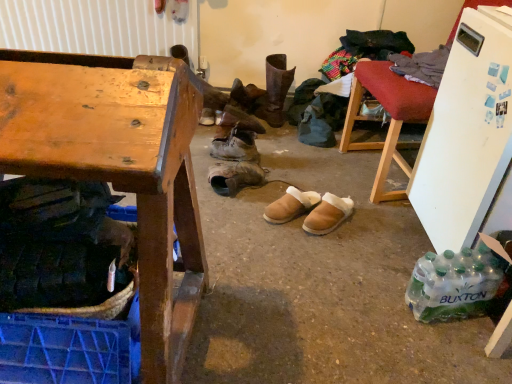
Locate an element on the screen. The width and height of the screenshot is (512, 384). clear plastic bottles at lower right is located at coordinates (454, 284).

What do you see at coordinates (119, 166) in the screenshot? This screenshot has height=384, width=512. I see `wooden desk at left` at bounding box center [119, 166].

The image size is (512, 384). I want to click on brown suede slippers at center, the first footwear in the bottom-to-top sequence, so click(x=311, y=210).

From the picture: What is the approximate height of brown suede slippers at center, the first footwear in the bottom-to-top sequence?

It is 5.41 inches.

Identify the location of wooden chair at upper right. (391, 119).

From the image's perspective, which one is positioned higher, leather boots at center, which is the third footwear in bottom-to-top order, or wooden chair at upper right?

wooden chair at upper right.

Which object is further away from the camera taking this photo, leather boots at center, arranged as the third footwear when viewed from the top, or wooden chair at upper right?

leather boots at center, arranged as the third footwear when viewed from the top, is further away from the camera.

Considering the sizes of leather boots at center, which is the third footwear in bottom-to-top order, and wooden chair at upper right in the image, is leather boots at center, which is the third footwear in bottom-to-top order, bigger or smaller than wooden chair at upper right?

leather boots at center, which is the third footwear in bottom-to-top order, is smaller than wooden chair at upper right.

From a real-world perspective, which object stands above the other?

leather boot at center, which ranks as the 1th footwear in top-to-bottom order, from a real-world perspective.

Is leather boots at center, placed as the fourth footwear when sorted from bottom to top, bigger than leather boot at center, which ranks as the 1th footwear in top-to-bottom order?

No, leather boots at center, placed as the fourth footwear when sorted from bottom to top, is not bigger than leather boot at center, which ranks as the 1th footwear in top-to-bottom order.

Which object is positioned more to the left, leather boots at center, the second footwear viewed from the top, or leather boot at center, which ranks as the 1th footwear in top-to-bottom order?

From the viewer's perspective, leather boots at center, the second footwear viewed from the top, appears more on the left side.

From a real-world perspective, which is physically below, leather boots at center, arranged as the third footwear when viewed from the top, or wooden desk at left?

leather boots at center, arranged as the third footwear when viewed from the top, is physically lower.

Is leather boots at center, arranged as the third footwear when viewed from the top, looking in the opposite direction of wooden desk at left?

No, wooden desk at left is not at the back of leather boots at center, arranged as the third footwear when viewed from the top.

Is leather boots at center, arranged as the third footwear when viewed from the top, touching wooden desk at left?

No, leather boots at center, arranged as the third footwear when viewed from the top, is not in contact with wooden desk at left.

Considering the positions of point (186, 279) and point (469, 268), is point (186, 279) closer or farther from the camera than point (469, 268)?

Point (186, 279).

Where is `desk above the clear plastic bottles at lower right (from the image's perspective)`? desk above the clear plastic bottles at lower right (from the image's perspective) is located at coordinates (119, 166).

Is wooden desk at left inside or outside of clear plastic bottles at lower right?

wooden desk at left is not inside clear plastic bottles at lower right, it's outside.

Does wooden desk at left come behind clear plastic bottles at lower right?

No, it is in front of clear plastic bottles at lower right.

Is leather boots at center, which is the third footwear in bottom-to-top order, inside or outside of leather boot at center, which ranks as the 1th footwear in top-to-bottom order?

The correct answer is: outside.

Is leather boots at center, which is the third footwear in bottom-to-top order, to the left of leather boot at center, which ranks as the 1th footwear in top-to-bottom order, from the viewer's perspective?

Yes, leather boots at center, which is the third footwear in bottom-to-top order, is to the left of leather boot at center, which ranks as the 1th footwear in top-to-bottom order.

Measure the distance from leather boots at center, arranged as the third footwear when viewed from the top, to leather boot at center, which ranks as the 1th footwear in top-to-bottom order.

leather boots at center, arranged as the third footwear when viewed from the top, is 58.01 centimeters from leather boot at center, which ranks as the 1th footwear in top-to-bottom order.

Is point (480, 257) positioned after point (313, 193)?

No, (480, 257) is in front of (313, 193).

Is clear plastic bottles at lower right positioned with its back to brown suede slippers at center, the 2th footwear from the bottom?

No, clear plastic bottles at lower right is not facing the opposite direction of brown suede slippers at center, the 2th footwear from the bottom.

Do you think clear plastic bottles at lower right is within brown suede slippers at center, the 2th footwear from the bottom, or outside of it?

The correct answer is: outside.

Considering the relative sizes of clear plastic bottles at lower right and brown suede slippers at center, which is counted as the 4th footwear, starting from the top, in the image provided, is clear plastic bottles at lower right taller than brown suede slippers at center, which is counted as the 4th footwear, starting from the top,?

Indeed, clear plastic bottles at lower right has a greater height compared to brown suede slippers at center, which is counted as the 4th footwear, starting from the top.

Is brown suede slippers at center, the 2th footwear from the bottom, wider or thinner than brown suede slippers at center, the first footwear in the bottom-to-top sequence?

brown suede slippers at center, the 2th footwear from the bottom, is wider than brown suede slippers at center, the first footwear in the bottom-to-top sequence.

Based on their sizes in the image, would you say brown suede slippers at center, which is counted as the 4th footwear, starting from the top, is bigger or smaller than brown suede slippers at center, the first footwear in the bottom-to-top sequence?

In the image, brown suede slippers at center, which is counted as the 4th footwear, starting from the top, appears to be smaller than brown suede slippers at center, the first footwear in the bottom-to-top sequence.

From the image's perspective, between brown suede slippers at center, which is counted as the 4th footwear, starting from the top, and brown suede slippers at center, the first footwear in the bottom-to-top sequence, which one is located above?

From the image's view, brown suede slippers at center, which is counted as the 4th footwear, starting from the top, is above.

In the scene shown: From a real-world perspective, which object rests below the other?

In real-world perspective, brown suede slippers at center, the 2th footwear from the bottom, is lower.

From the wooden chair at upper right, count 3rd footwears backward and point to it. Please provide its 2D coordinates.

[(234, 176)]

There is a leather boot at center, which ranks as the 1th footwear in top-to-bottom order. Where is `the 1st footwear below it (from a real-world perspective)`? The image size is (512, 384). the 1st footwear below it (from a real-world perspective) is located at coordinates (236, 147).

When comparing their distances from wooden desk at left, does wooden chair at upper right or leather boot at center, which is the fifth footwear from bottom to top, seem further?

The object further to wooden desk at left is leather boot at center, which is the fifth footwear from bottom to top.

Looking at the image, which one is located further to brown suede slippers at center, the 5th footwear from the top, brown suede slippers at center, which is counted as the 4th footwear, starting from the top, or wooden desk at left?

wooden desk at left is further to brown suede slippers at center, the 5th footwear from the top.

Which object lies further to the anchor point clear plastic bottles at lower right, leather boots at center, the second footwear viewed from the top, or brown suede slippers at center, the 5th footwear from the top?

leather boots at center, the second footwear viewed from the top, lies further to clear plastic bottles at lower right than the other object.

Looking at this image, considering their positions, is leather boot at center, which is the fifth footwear from bottom to top, positioned closer to clear plastic bottles at lower right than wooden chair at upper right?

Based on the image, wooden chair at upper right appears to be nearer to clear plastic bottles at lower right.

Based on their spatial positions, is leather boots at center, the second footwear viewed from the top, or wooden chair at upper right closer to brown suede slippers at center, the first footwear in the bottom-to-top sequence?

Among the two, wooden chair at upper right is located nearer to brown suede slippers at center, the first footwear in the bottom-to-top sequence.

From the image, which object appears to be nearer to leather boots at center, the second footwear viewed from the top, brown suede slippers at center, the 2th footwear from the bottom, or wooden desk at left?

The object closer to leather boots at center, the second footwear viewed from the top, is brown suede slippers at center, the 2th footwear from the bottom.

When comparing their distances from brown suede slippers at center, the first footwear in the bottom-to-top sequence, does wooden desk at left or leather boots at center, which is the third footwear in bottom-to-top order, seem closer?

leather boots at center, which is the third footwear in bottom-to-top order, is closer to brown suede slippers at center, the first footwear in the bottom-to-top sequence.

From the image, which object appears to be nearer to leather boot at center, which ranks as the 1th footwear in top-to-bottom order, leather boots at center, placed as the fourth footwear when sorted from bottom to top, or wooden chair at upper right?

leather boots at center, placed as the fourth footwear when sorted from bottom to top, is positioned closer to the anchor leather boot at center, which ranks as the 1th footwear in top-to-bottom order.

Where is `footwear between wooden desk at left and brown suede slippers at center, which is counted as the 4th footwear, starting from the top, in the front-back direction`? This screenshot has width=512, height=384. footwear between wooden desk at left and brown suede slippers at center, which is counted as the 4th footwear, starting from the top, in the front-back direction is located at coordinates (311, 210).

Where is `bottle located between wooden desk at left and wooden chair at upper right in the left-right direction`? bottle located between wooden desk at left and wooden chair at upper right in the left-right direction is located at coordinates (454, 284).

In order to click on bottle positioned between wooden desk at left and leather boots at center, which is the third footwear in bottom-to-top order, from near to far in this screenshot , I will do `click(454, 284)`.

Find the location of a particular element. The height and width of the screenshot is (384, 512). bottle between leather boots at center, the second footwear viewed from the top, and wooden chair at upper right, in the horizontal direction is located at coordinates (454, 284).